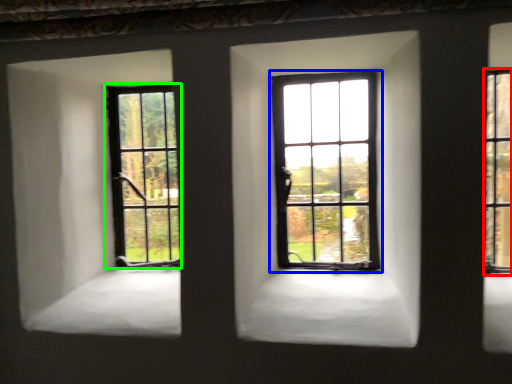
Question: Estimate the real-world distances between objects in this image. Which object is closer to window (highlighted by a red box), window (highlighted by a blue box) or window (highlighted by a green box)?

Choices:
 (A) window
 (B) window

Answer: (A)